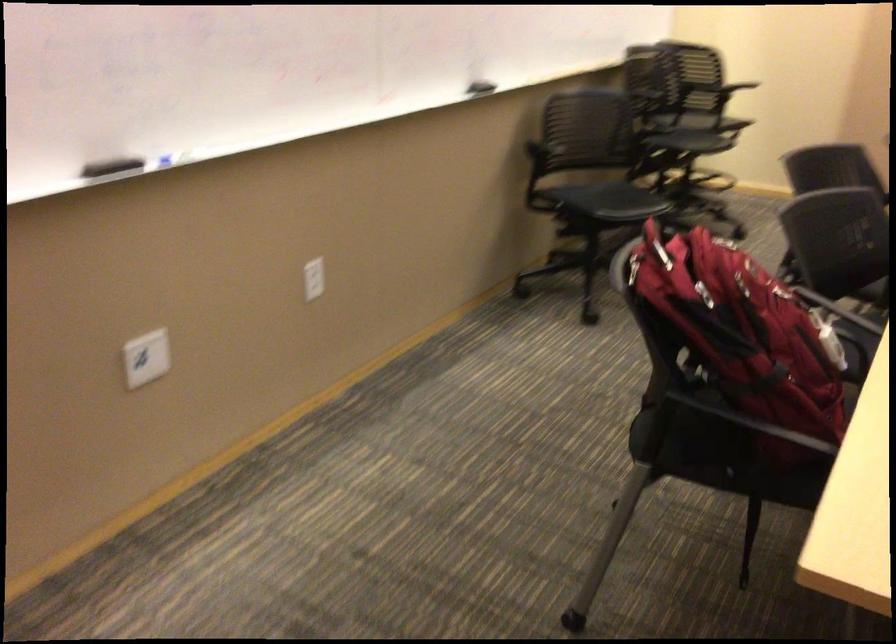
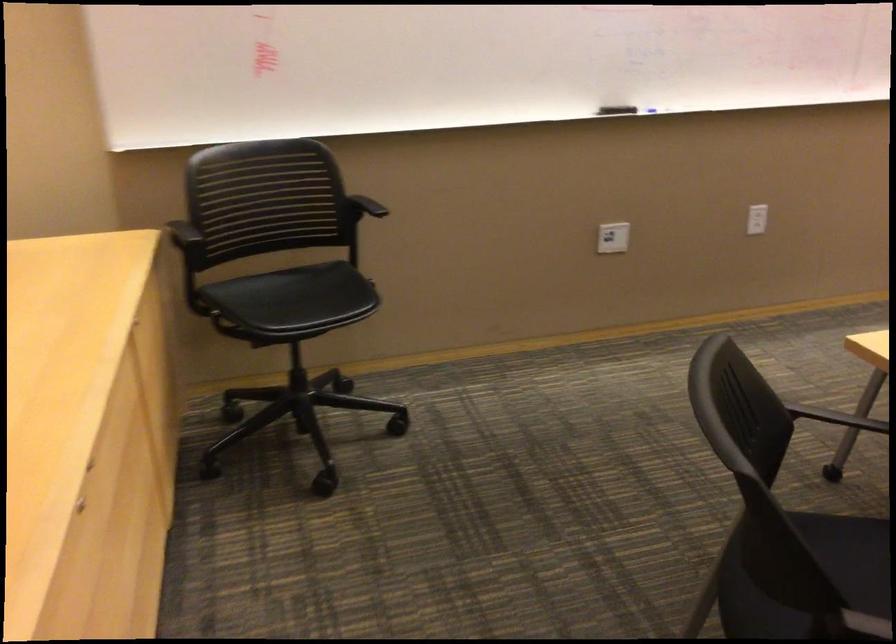
The point at (114, 174) is marked in the first image. Where is the corresponding point in the second image?

(616, 109)